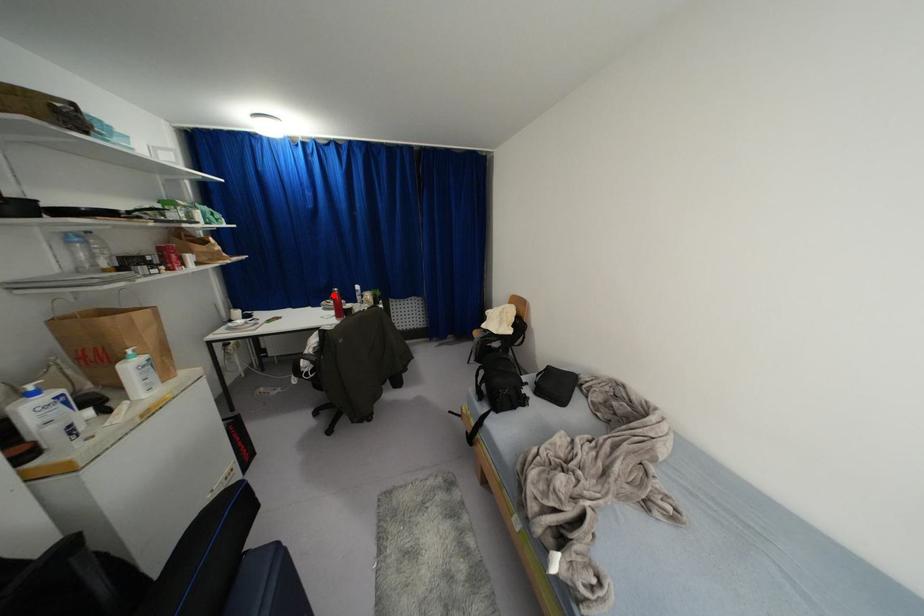
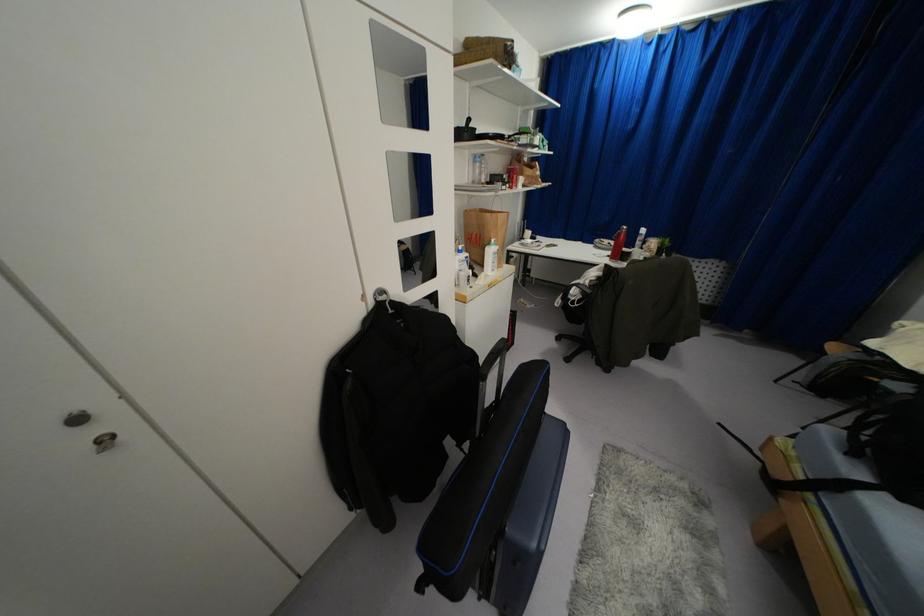
Question: I am providing you with two images of the same scene from different viewpoints. In image1, a red point is highlighted. Considering the same 3D point in image2, which of the following is correct?

Choices:
 (A) It is closer
 (B) It is farther

Answer: (A)